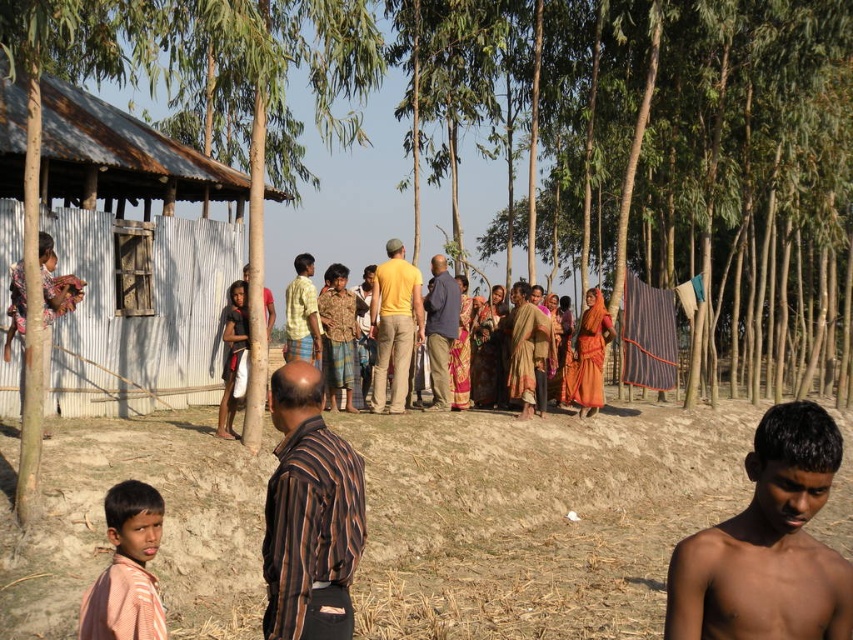
Question: Observing the image, what is the correct spatial positioning of brown wood tree at center in reference to shiny brown skin at lower right?

Choices:
 (A) right
 (B) left

Answer: (B)

Question: From the image, what is the correct spatial relationship of brown wood tree at center in relation to yellow matte shirt at center?

Choices:
 (A) left
 (B) right

Answer: (B)

Question: Which point is farther to the camera?

Choices:
 (A) (764, 484)
 (B) (849, 420)

Answer: (B)

Question: Does brown wood tree at center appear on the right side of brown dirt field at lower center?

Choices:
 (A) no
 (B) yes

Answer: (A)

Question: Which point is farther from the camera taking this photo?

Choices:
 (A) (451, 314)
 (B) (415, 308)
 (C) (236, 353)
 (D) (694, 556)

Answer: (A)

Question: Which point is closer to the camera?

Choices:
 (A) brown striped shirt at center
 (B) yellow plaid shirt at center

Answer: (A)